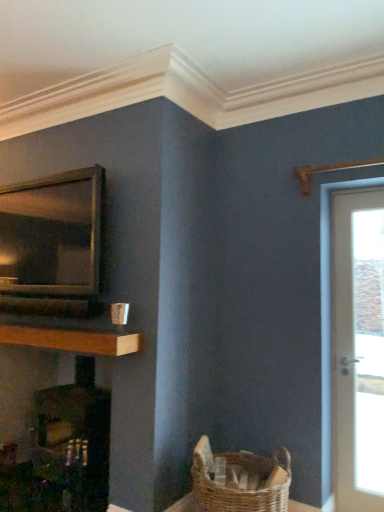
Where is `wooden at left`? wooden at left is located at coordinates [x=73, y=339].

Measure the distance between white glossy door at right and camera.

The depth of white glossy door at right is 2.57 meters.

Image resolution: width=384 pixels, height=512 pixels. Identify the location of wooden at left. (73, 339).

Is white glossy door at right situated inside wooden at left or outside?

white glossy door at right exists outside the volume of wooden at left.

What's the angular difference between white glossy door at right and wooden at left's facing directions?

The facing directions of white glossy door at right and wooden at left are 0.276 degrees apart.

Does white glossy door at right have a smaller size compared to wooden at left?

Correct, white glossy door at right occupies less space than wooden at left.

Which is more distant, (49, 269) or (340, 356)?

Positioned behind is point (49, 269).

Between metallic silver microwave at left and white glossy door at right, which one has larger width?

metallic silver microwave at left.

Is metallic silver microwave at left at the back of matte black fireplace at left?

matte black fireplace at left is not turned away from metallic silver microwave at left.

How many degrees apart are the facing directions of matte black fireplace at left and metallic silver microwave at left?

The facing directions of matte black fireplace at left and metallic silver microwave at left are 0.0561 degrees apart.

Which is correct: matte black fireplace at left is inside metallic silver microwave at left, or outside of it?

matte black fireplace at left is spatially situated outside metallic silver microwave at left.

From a real-world perspective, is matte black fireplace at left located higher than metallic silver microwave at left?

Actually, matte black fireplace at left is physically below metallic silver microwave at left in the real world.

Between point (381, 420) and point (15, 303), which one is positioned behind?

Point (381, 420)

Considering their positions, is white glossy door at right located in front of or behind metallic silver microwave at left?

Clearly, white glossy door at right is behind metallic silver microwave at left.

From the image's perspective, between white glossy door at right and metallic silver microwave at left, which one is located above?

From the image's view, metallic silver microwave at left is above.

From a real-world perspective, between wooden at left and matte black fireplace at left, who is vertically lower?

matte black fireplace at left.

From the image's perspective, between wooden at left and matte black fireplace at left, who is located below?

matte black fireplace at left is shown below in the image.

Between wooden at left and matte black fireplace at left, which one is positioned in front?

wooden at left is in front.

Which of these two, metallic silver microwave at left or wooden at left, is smaller?

wooden at left.

Which is behind, metallic silver microwave at left or wooden at left?

metallic silver microwave at left is further away from the camera.

Is metallic silver microwave at left positioned beyond the bounds of wooden at left?

Absolutely, metallic silver microwave at left is external to wooden at left.

Is matte black fireplace at left facing towards wooden at left?

No, matte black fireplace at left is not aimed at wooden at left.

In the scene shown: Is matte black fireplace at left thinner than wooden at left?

No.

From the image's perspective, which is below, matte black fireplace at left or wooden at left?

matte black fireplace at left, from the image's perspective.

Which of these two, matte black fireplace at left or wooden at left, stands shorter?

wooden at left.

I want to click on door on the right of wooden at left, so click(x=351, y=343).

In the image, there is a white glossy door at right. Where is `appliance above it (from the image's perspective)`? appliance above it (from the image's perspective) is located at coordinates (52, 244).

Considering their positions, is wooden at left positioned closer to white glossy door at right than metallic silver microwave at left?

The object closer to white glossy door at right is wooden at left.

When comparing their distances from wooden at left, does white glossy door at right or metallic silver microwave at left seem further?

Among the two, white glossy door at right is located further to wooden at left.

From the image, which object appears to be nearer to wooden at left, matte black fireplace at left or white glossy door at right?

matte black fireplace at left is closer to wooden at left.

Considering their positions, is matte black fireplace at left positioned further to wooden at left than metallic silver microwave at left?

The object further to wooden at left is matte black fireplace at left.

Looking at the image, which one is located further to metallic silver microwave at left, matte black fireplace at left or wooden at left?

matte black fireplace at left is positioned further to the anchor metallic silver microwave at left.

From the picture: Which object lies nearer to the anchor point metallic silver microwave at left, matte black fireplace at left or white glossy door at right?

matte black fireplace at left lies closer to metallic silver microwave at left than the other object.

When comparing their distances from matte black fireplace at left, does wooden at left or metallic silver microwave at left seem further?

metallic silver microwave at left is further to matte black fireplace at left.

When comparing their distances from wooden at left, does metallic silver microwave at left or white glossy door at right seem closer?

metallic silver microwave at left lies closer to wooden at left than the other object.

Identify the location of shelf between metallic silver microwave at left and matte black fireplace at left vertically. The image size is (384, 512). (73, 339).

What are the coordinates of `fireplace between wooden at left and white glossy door at right from left to right` in the screenshot? It's located at (77, 440).

Where is `fireplace situated between metallic silver microwave at left and white glossy door at right from left to right`? The width and height of the screenshot is (384, 512). fireplace situated between metallic silver microwave at left and white glossy door at right from left to right is located at coordinates (77, 440).

I want to click on shelf located between metallic silver microwave at left and white glossy door at right in the left-right direction, so click(73, 339).